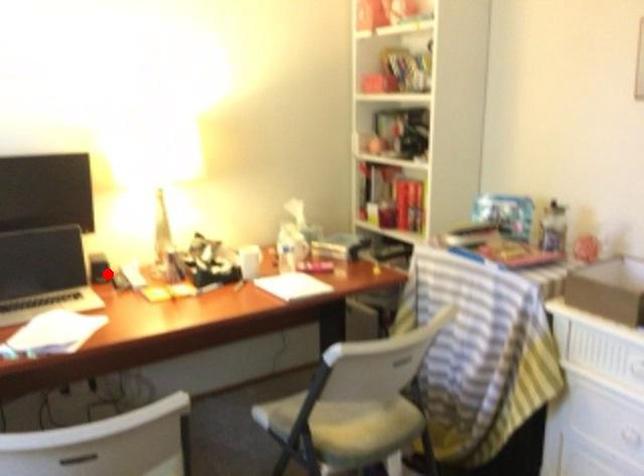
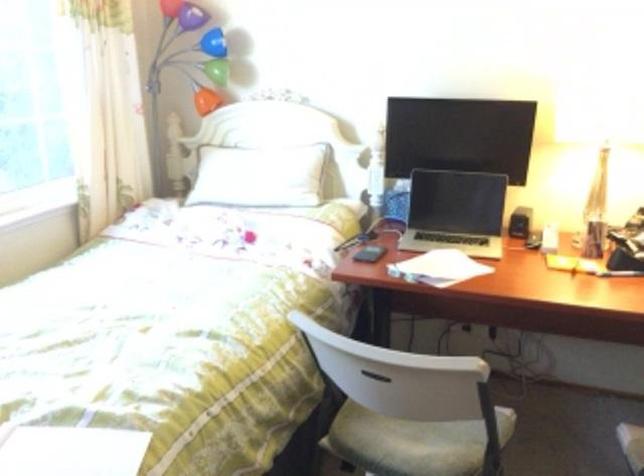
Question: I am providing you with two images of the same scene from different viewpoints. In image1, a red point is highlighted. Considering the same 3D point in image2, which of the following is correct?

Choices:
 (A) It is closer
 (B) It is farther

Answer: (A)